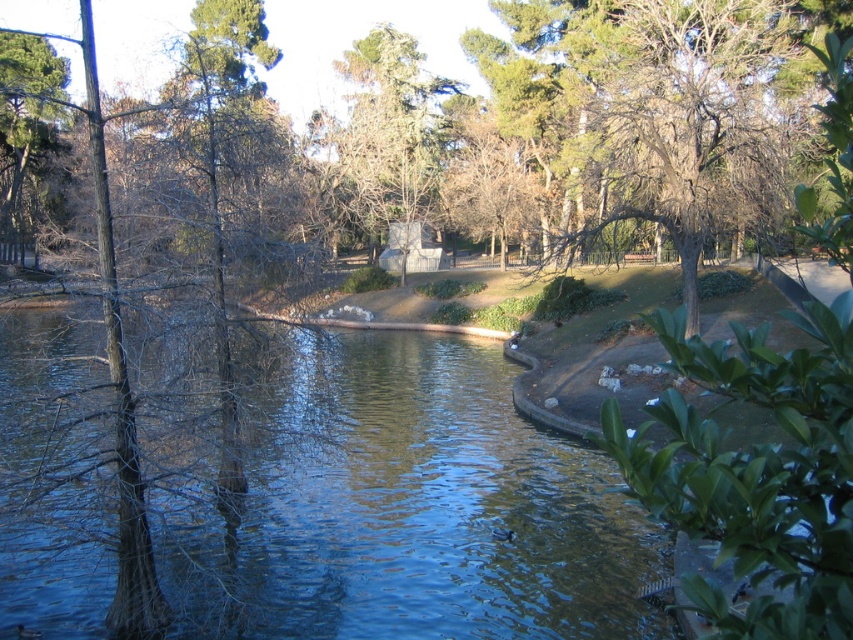
Which is above, brown/dry bark tree at upper right or green matte tree at upper left?

brown/dry bark tree at upper right

Does brown/dry bark tree at upper right have a greater height compared to green matte tree at upper left?

Correct, brown/dry bark tree at upper right is much taller as green matte tree at upper left.

Does point (685, 61) come in front of point (4, 51)?

Yes, point (685, 61) is closer to viewer.

Find the location of a particular element. brown/dry bark tree at upper right is located at coordinates (686, 116).

Does blue water at center have a greater height compared to green leafy tree at center?

No, blue water at center is not taller than green leafy tree at center.

Which is in front, point (48, 371) or point (381, 49)?

Positioned in front is point (48, 371).

Identify the location of blue water at center. (412, 513).

Between brown/dry bark tree at upper right and green leafy tree at center, which one is positioned lower?

brown/dry bark tree at upper right is lower down.

From the picture: Between brown/dry bark tree at upper right and green leafy tree at center, which one appears on the right side from the viewer's perspective?

brown/dry bark tree at upper right is more to the right.

Locate an element on the screen. The width and height of the screenshot is (853, 640). brown/dry bark tree at upper right is located at coordinates (686, 116).

You are a GUI agent. You are given a task and a screenshot of the screen. Output one action in this format:
    pyautogui.click(x=<x>, y=<y>)
    Task: Click on the brown/dry bark tree at upper right
    The height and width of the screenshot is (640, 853).
    Given the screenshot: What is the action you would take?
    pyautogui.click(x=686, y=116)